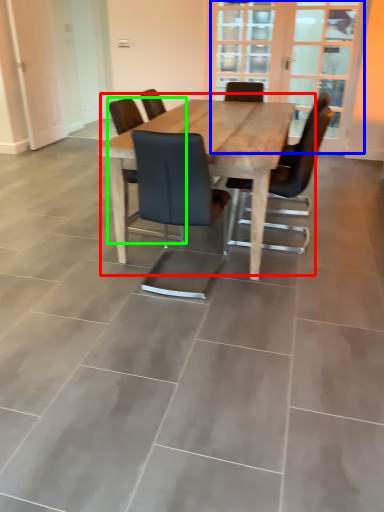
Question: Which object is the closest to the kitchen & dining room table (highlighted by a red box)? Choose among these: screen door (highlighted by a blue box) or chair (highlighted by a green box).

Choices:
 (A) screen door
 (B) chair

Answer: (B)